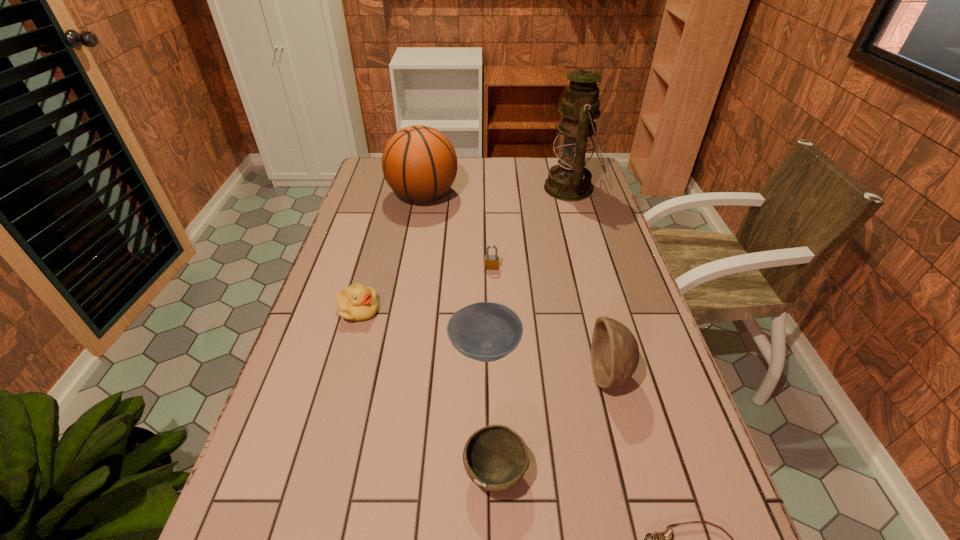
I want to click on object located at the far right corner, so click(x=569, y=180).

Where is `blank space at the far edge of the desktop`? blank space at the far edge of the desktop is located at coordinates (501, 170).

Where is `free space at the left edge of the desktop`? This screenshot has width=960, height=540. free space at the left edge of the desktop is located at coordinates click(x=353, y=383).

Image resolution: width=960 pixels, height=540 pixels. In the image, there is a desktop. What are the coordinates of `free space at the right edge` in the screenshot? It's located at (628, 456).

Image resolution: width=960 pixels, height=540 pixels. In the image, there is a desktop. In order to click on vacant space at the far left corner in this screenshot , I will do `click(372, 170)`.

I want to click on empty space between the tallest bowl and the nearest bowl, so click(x=552, y=424).

Identify the location of vacant area that lies between the seventh shortest object and the tallest object. (497, 192).

This screenshot has height=540, width=960. In order to click on vacant area that lies between the padlock and the nearest bowl in this screenshot , I will do `click(493, 370)`.

Find the location of a particular element. This screenshot has height=540, width=960. free space between the sixth nearest object and the seventh shortest object is located at coordinates tap(457, 232).

Where is `vacant space that is in between the duckling and the seventh shortest object`? The height and width of the screenshot is (540, 960). vacant space that is in between the duckling and the seventh shortest object is located at coordinates (391, 253).